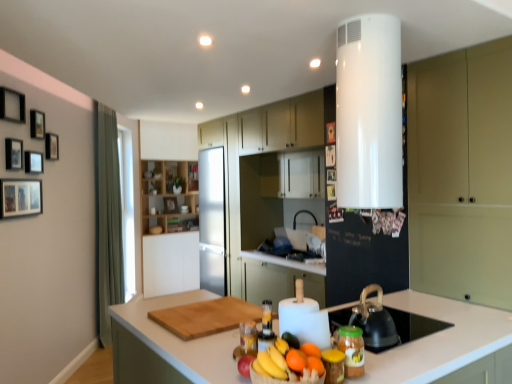
Question: From a real-world perspective, is white glossy water heater at upper center physically located above or below wooden shelves at center, which is the 1th cabinetry from left to right?

Choices:
 (A) below
 (B) above

Answer: (B)

Question: In the image, is white glossy water heater at upper center on the left side or the right side of wooden shelves at center, marked as the fourth cabinetry in a front-to-back arrangement?

Choices:
 (A) left
 (B) right

Answer: (B)

Question: Considering the real-world distances, which object is closest to the white glossy water heater at upper center?

Choices:
 (A) wooden picture frame at upper left, acting as the tenth picture frame starting from the back
 (B) wooden picture frame at upper left, which is the second picture frame in back-to-front order
 (C) wooden picture frame at upper center, marked as the 7th picture frame in a front-to-back arrangement
 (D) orange matte at center, arranged as the 1th orange when viewed from the back
 (E) translucent amber jar at lower right, acting as the first bottle starting from the front

Answer: (E)

Question: Based on their relative distances, which object is nearer to the matte white cabinet at center, acting as the third cabinetry starting from the back?

Choices:
 (A) orange matte at center, which is the first orange in front-to-back order
 (B) wooden picture frame at upper left, the first picture frame viewed from the left
 (C) shiny golden bananas at center
 (D) satin white refrigerator at center, placed as the 2th cabinetry when sorted from left to right
 (E) orange matte at center, the second orange positioned from the front

Answer: (D)